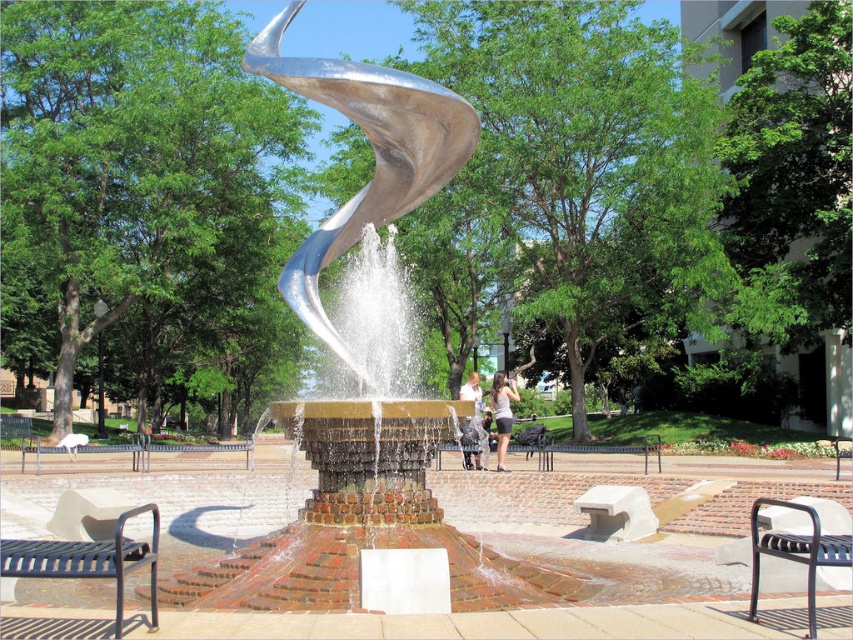
Is black wrought iron bench at lower left thinner than black metal bench at center?

Yes.

Does black wrought iron bench at lower left have a smaller size compared to black metal bench at center?

Correct, black wrought iron bench at lower left occupies less space than black metal bench at center.

Find the location of `black wrought iron bench at lower left`. black wrought iron bench at lower left is located at coordinates (90, 560).

From the picture: Does matte gray shirt at center appear on the left side of matte silver statue at center?

Incorrect, matte gray shirt at center is not on the left side of matte silver statue at center.

Who is more forward, (503, 401) or (474, 452)?

Point (474, 452) is in front.

The height and width of the screenshot is (640, 853). Identify the location of matte gray shirt at center. (502, 412).

In order to click on black metal bench at lower right in this screenshot , I will do `click(796, 552)`.

Who is shorter, black metal bench at lower right or black metal bench at center?

With less height is black metal bench at lower right.

Which is behind, point (751, 620) or point (585, 449)?

Positioned behind is point (585, 449).

Find the location of a particular element. The width and height of the screenshot is (853, 640). black metal bench at lower right is located at coordinates (796, 552).